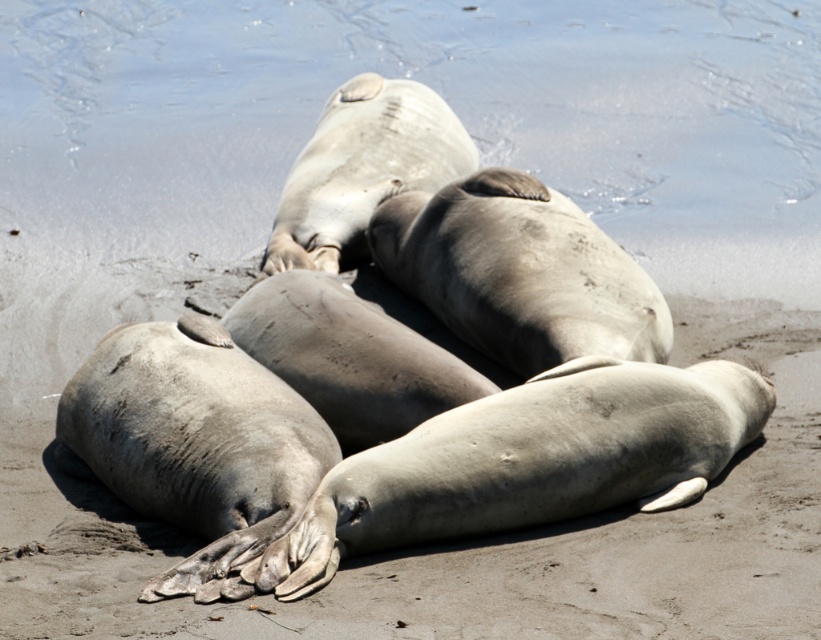
You are standing on the beach where the elephant seals are resting. You want to find the clear water to cool off your feet. According to the coordinates provided, where should you look to find the clear water at upper center?

The clear water at upper center is located at coordinates point (447, 102).

You are a photographer trying to capture the entire scene of the elephant seals on the beach. You notice the clear water at upper center and the gray sandy beach at center. Which area should you focus on to ensure the seals and their surroundings are fully visible in your photo?

The gray sandy beach at center is larger than the clear water at upper center, so focusing on the gray sandy beach at center will ensure the seals and their surroundings are fully visible in your photo.